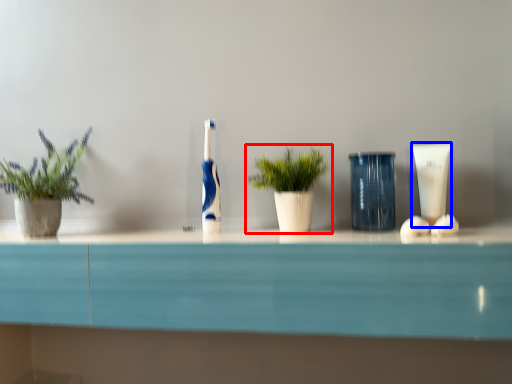
Question: Which object appears closest to the camera in this image, houseplant (highlighted by a red box) or toiletry (highlighted by a blue box)?

Choices:
 (A) houseplant
 (B) toiletry

Answer: (A)